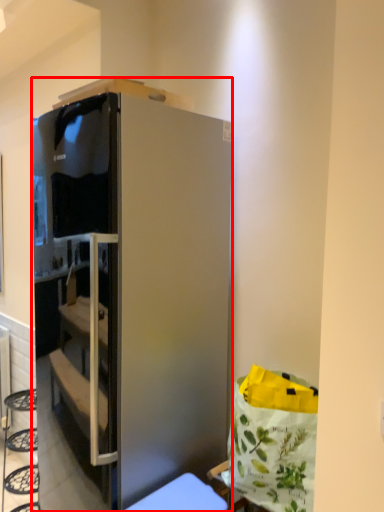
Question: From the image's perspective, what is the correct spatial positioning of cabinetry (annotated by the red box) in reference to furniture?

Choices:
 (A) above
 (B) below

Answer: (A)